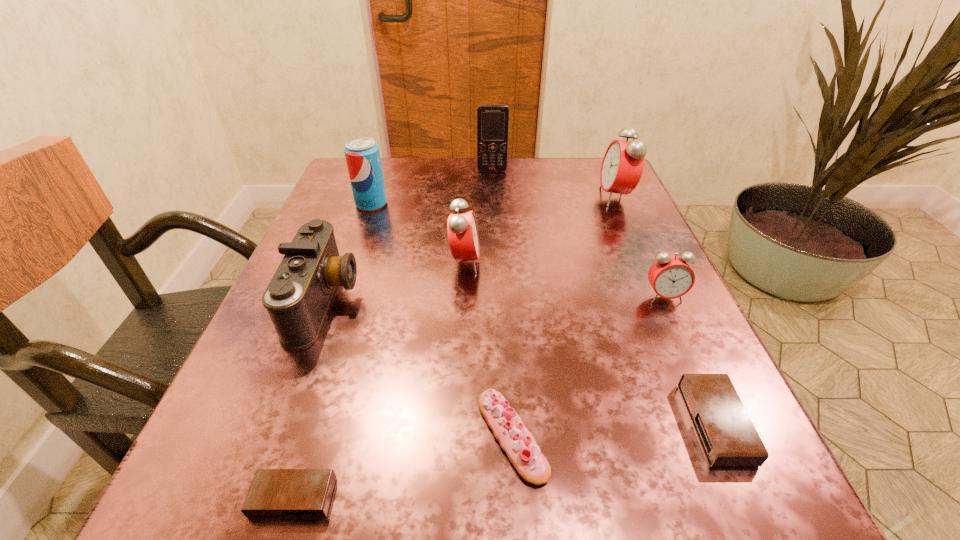
The image size is (960, 540). What are the coordinates of `vacant space located on the front-facing side of the fourth alarm clock from right to left` in the screenshot? It's located at (590, 262).

At what (x,y) coordinates should I click in order to perform the action: click on free space located 0.170m on the lens of the camera. Please return your answer as a coordinate pair (x, y). The image size is (960, 540). Looking at the image, I should click on (455, 301).

Identify the location of free region located 0.220m on the front-facing side of the nearest red alarm clock. The width and height of the screenshot is (960, 540). (721, 422).

The width and height of the screenshot is (960, 540). What are the coordinates of `free space located on the back of the third shortest object` in the screenshot? It's located at (508, 359).

Find the location of a particular element. The height and width of the screenshot is (540, 960). vacant space located on the front face of the fourth tallest alarm clock is located at coordinates (639, 423).

Identify the location of vacant point located on the front face of the fourth tallest alarm clock. (412, 423).

What are the coordinates of `free space located on the front face of the fourth tallest alarm clock` in the screenshot? It's located at (495, 423).

Identify the location of cellular telephone situated at the far edge. The image size is (960, 540). (492, 119).

I want to click on alarm clock that is at the far edge, so click(623, 163).

Locate an element on the screen. The image size is (960, 540). soda can that is at the far edge is located at coordinates [362, 155].